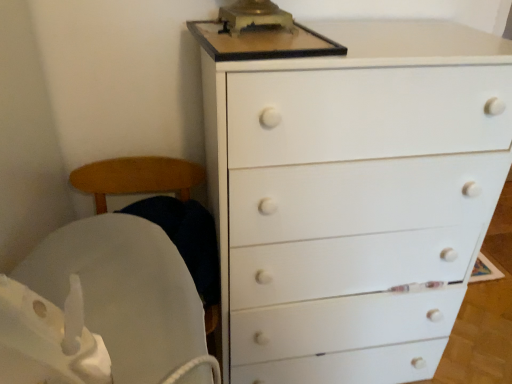
Question: From the image's perspective, is white matte chest of drawers at upper right above or below white fabric rocking chair at left?

Choices:
 (A) above
 (B) below

Answer: (A)

Question: In terms of width, does white matte chest of drawers at upper right look wider or thinner when compared to white fabric rocking chair at left?

Choices:
 (A) wide
 (B) thin

Answer: (A)

Question: Considering the relative positions of white matte chest of drawers at upper right and white fabric rocking chair at left in the image provided, is white matte chest of drawers at upper right to the left or to the right of white fabric rocking chair at left?

Choices:
 (A) right
 (B) left

Answer: (A)

Question: From a real-world perspective, is white fabric rocking chair at left positioned above or below white matte chest of drawers at upper right?

Choices:
 (A) above
 (B) below

Answer: (B)

Question: Is white fabric rocking chair at left inside or outside of white matte chest of drawers at upper right?

Choices:
 (A) outside
 (B) inside

Answer: (A)

Question: Is point (103, 258) closer or farther from the camera than point (245, 183)?

Choices:
 (A) farther
 (B) closer

Answer: (B)

Question: Considering the positions of white fabric rocking chair at left and white matte chest of drawers at upper right in the image, is white fabric rocking chair at left taller or shorter than white matte chest of drawers at upper right?

Choices:
 (A) tall
 (B) short

Answer: (B)